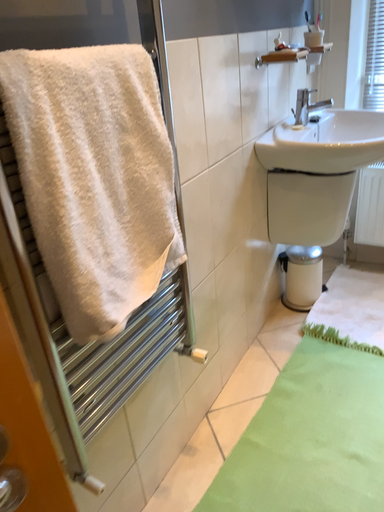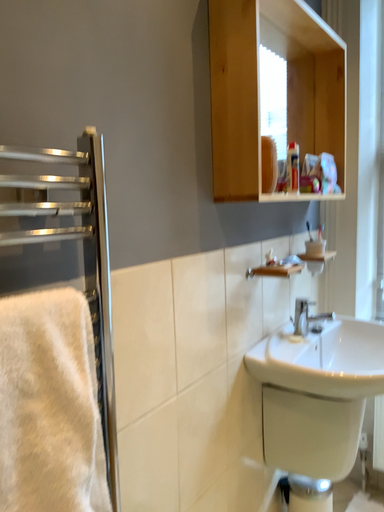
Question: How did the camera likely rotate when shooting the video?

Choices:
 (A) rotated upward
 (B) rotated downward

Answer: (A)